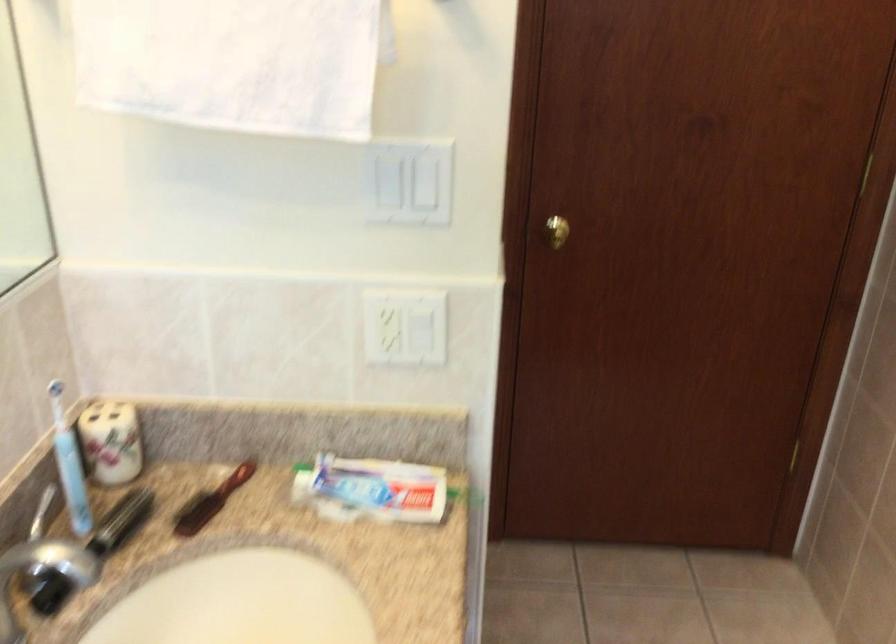
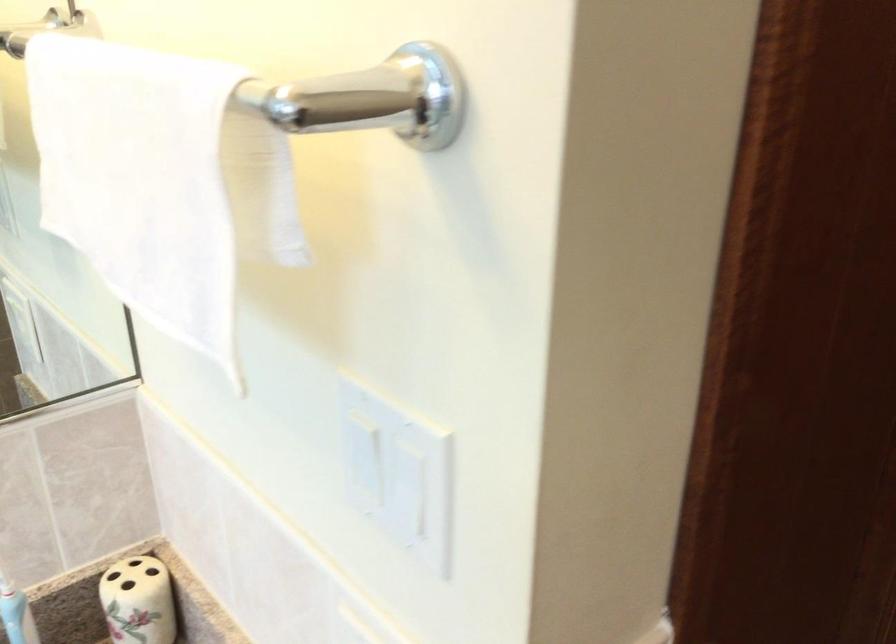
Question: Based on the continuous images, in which direction is the camera rotating? Reply with the corresponding letter.

Choices:
 (A) Left
 (B) Right
 (C) Up
 (D) Down

Answer: (A)